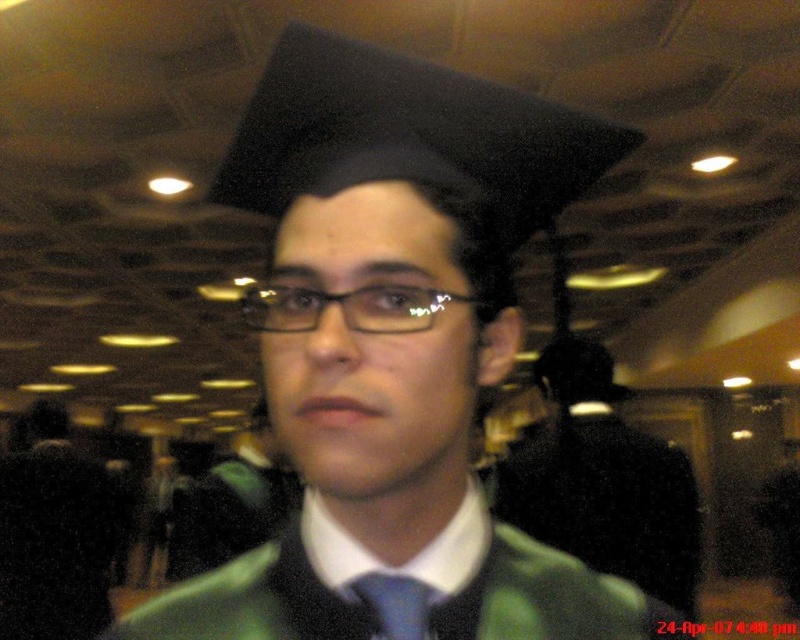
You are an event planner setting up a camera for a graduation photo. The camera is positioned to capture the matte black graduation cap at upper center. If the camera has a crosshair at coordinates 0.5, 0.5, will the cap be centered in the photo?

The matte black graduation cap at upper center is located at coordinates (397, 348), which is very close to the camera crosshair at (400, 320). Therefore, the cap will be nearly centered in the photo.

Based on the photo, you are organizing a photo album and need to place a label indicating which object is bigger between the green matte graduation gown at center and the black plastic glasses at center. Based on the scene, which one should you label as larger?

The green matte graduation gown at center is larger in size than the black plastic glasses at center, so you should label the green matte graduation gown at center as the larger object.

You are a photographer at a graduation ceremony. You need to adjust the camera focus to capture both the matte black graduation cap at upper center and the blue silk tie at center clearly. Which object should you focus on first to ensure proper depth of field?

The matte black graduation cap at upper center is taller than the blue silk tie at center, so focusing on the taller object first will help ensure both are in focus due to its greater distance from the camera.